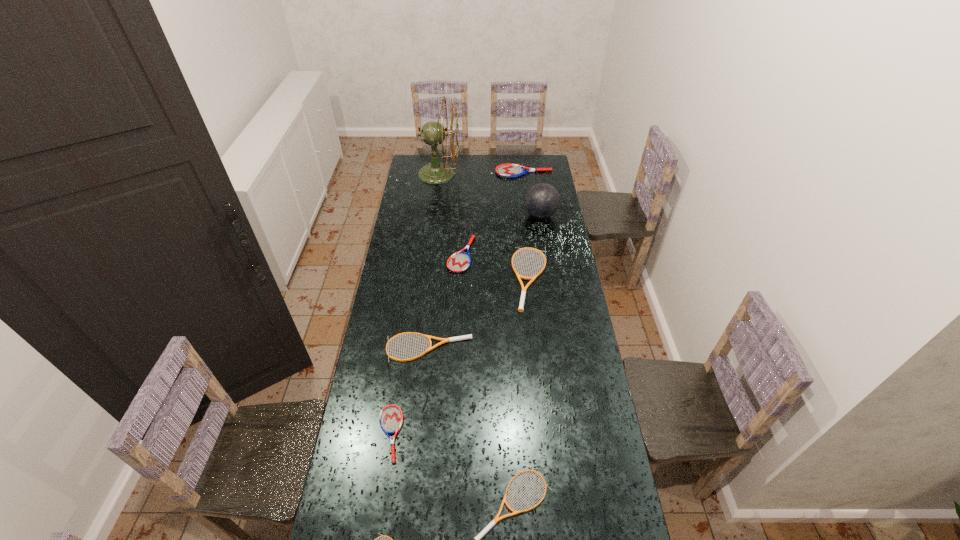
The width and height of the screenshot is (960, 540). Identify the location of free space located 0.300m on the back of the leftmost blue tennis racket. (403, 339).

Locate an element on the screen. This screenshot has width=960, height=540. fan present at the far edge is located at coordinates (433, 133).

Find the location of a particular element. The width and height of the screenshot is (960, 540). tennis racket that is at the far edge is located at coordinates (504, 170).

Locate an element on the screen. Image resolution: width=960 pixels, height=540 pixels. fan that is at the left edge is located at coordinates [x=433, y=133].

This screenshot has height=540, width=960. Find the location of `bowling ball present at the right edge`. bowling ball present at the right edge is located at coordinates (542, 200).

Locate an element on the screen. The height and width of the screenshot is (540, 960). object situated at the far left corner is located at coordinates (433, 133).

This screenshot has width=960, height=540. Find the location of `object that is positioned at the far right corner`. object that is positioned at the far right corner is located at coordinates click(504, 170).

Find the location of a particular element. Image resolution: width=960 pixels, height=540 pixels. free space at the left edge of the desktop is located at coordinates (394, 288).

This screenshot has width=960, height=540. I want to click on vacant space at the right edge of the desktop, so click(530, 182).

Find the location of a particular element. This screenshot has height=540, width=960. free area in between the rightmost blue tennis racket and the seventh farthest object is located at coordinates (456, 303).